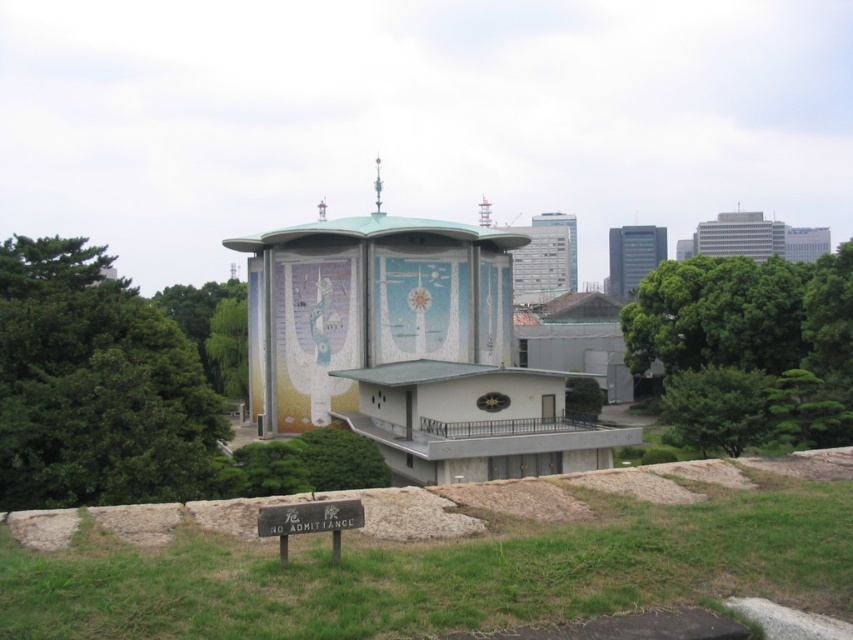
You are planning to install a new water fountain between the green leafy tree at right and the smooth concrete tower at center. The fountain requires a minimum of 200 feet of space between the tree and the tower to be placed safely. Based on the scene, can the fountain be installed there?

The distance between the green leafy tree at right and the smooth concrete tower at center is 207.09 feet, which exceeds the required 200 feet. Therefore, the fountain can be safely installed there.

You are standing at the entrance of the modern architectural structure and want to find the green leafy tree at center. According to the coordinates provided, where should you look to locate it?

The green leafy tree at center is located at coordinates point (213, 330), so you should look towards the center of the image slightly to the right and above the midpoint.